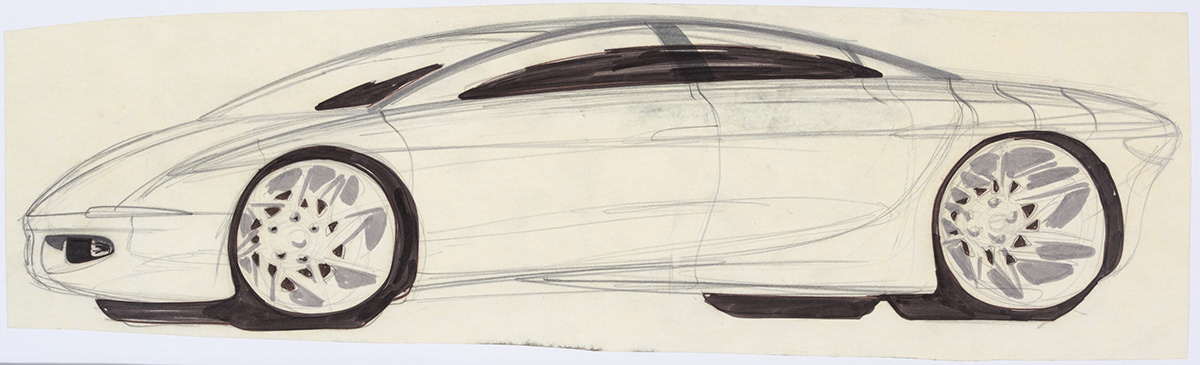
You are a GUI agent. You are given a task and a screenshot of the screen. Output one action in this format:
    pyautogui.click(x=<x>, y=<y>)
    Task: Click on the window
    This screenshot has width=1200, height=365.
    Given the screenshot: What is the action you would take?
    pyautogui.click(x=628, y=62), pyautogui.click(x=342, y=80)